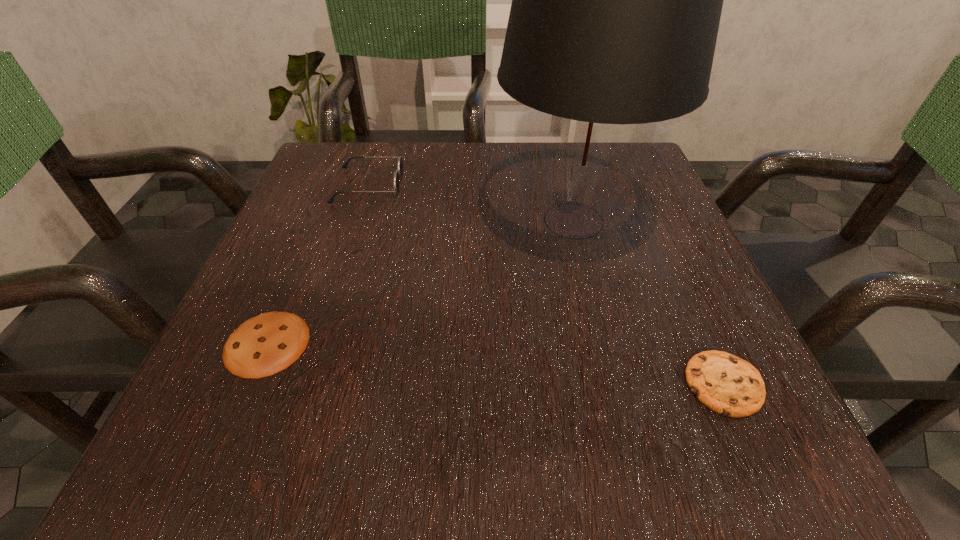
Identify the location of vacant space in between the sunglasses and the left cookie. (318, 264).

Find the location of `empty space that is in between the tallest object and the right cookie`. empty space that is in between the tallest object and the right cookie is located at coordinates (649, 302).

This screenshot has width=960, height=540. I want to click on object that can be found as the third closest to the lampshade, so click(x=266, y=344).

Identify the location of object that stands as the third closest to the right cookie. (398, 174).

The height and width of the screenshot is (540, 960). What are the coordinates of `vacant space that satisfies the following two spatial constraints: 1. on the front-facing side of the third shortest object; 2. on the right side of the right cookie` in the screenshot? It's located at (305, 384).

Locate an element on the screen. The height and width of the screenshot is (540, 960). free space that satisfies the following two spatial constraints: 1. on the back side of the right cookie; 2. on the front-facing side of the sunglasses is located at coordinates (636, 185).

Where is `free spot that satisfies the following two spatial constraints: 1. on the back side of the right cookie; 2. on the front-facing side of the sunglasses`? The image size is (960, 540). free spot that satisfies the following two spatial constraints: 1. on the back side of the right cookie; 2. on the front-facing side of the sunglasses is located at coordinates (636, 185).

Identify the location of free space that satisfies the following two spatial constraints: 1. on the front-facing side of the sunglasses; 2. on the front side of the left cookie. The image size is (960, 540). (318, 343).

Find the location of a particular element. vacant area that satisfies the following two spatial constraints: 1. on the front-facing side of the sunglasses; 2. on the front side of the left cookie is located at coordinates (318, 343).